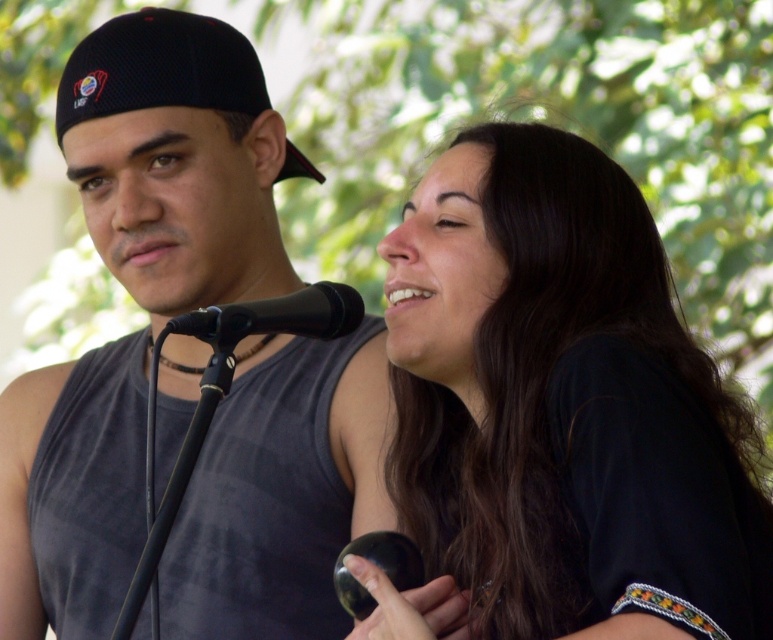
You are a photographer adjusting your camera settings. You notice the black mesh baseball cap at upper left and the black matte microphone at center. Which object should you focus on first if you want to capture both in the frame without zooming in or out?

The black mesh baseball cap at upper left is larger in size than the black matte microphone at center, so you should focus on the black mesh baseball cap at upper left first to ensure it fits properly in the frame.

You are a photographer adjusting your camera settings to focus on the black matte hair at upper right and the black matte tank top at center. Which object should you adjust the focus for first if you want to ensure both are in focus, considering their sizes?

The black matte hair at upper right has a smaller size compared to the black matte tank top at center, so you should focus on the smaller black matte hair at upper right first to ensure both are in focus.